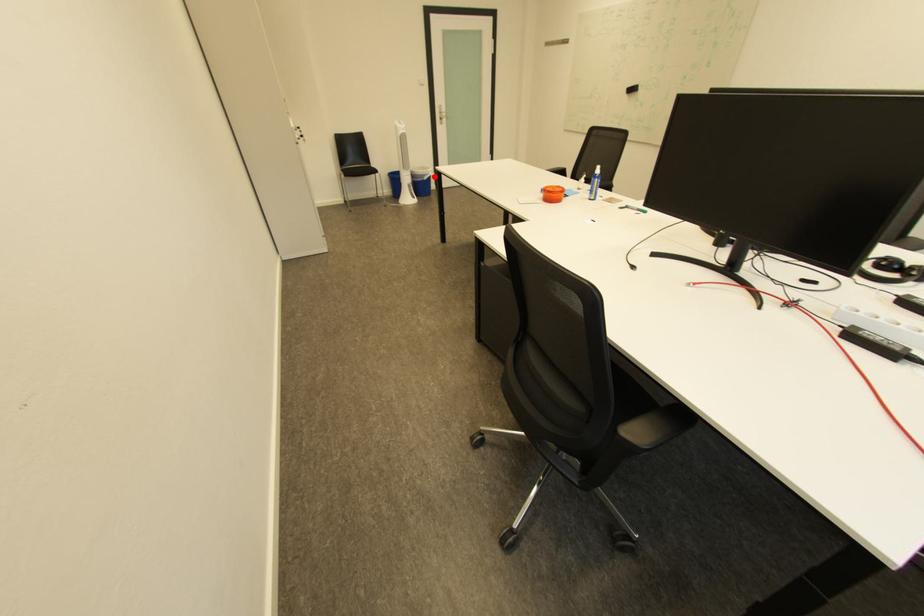
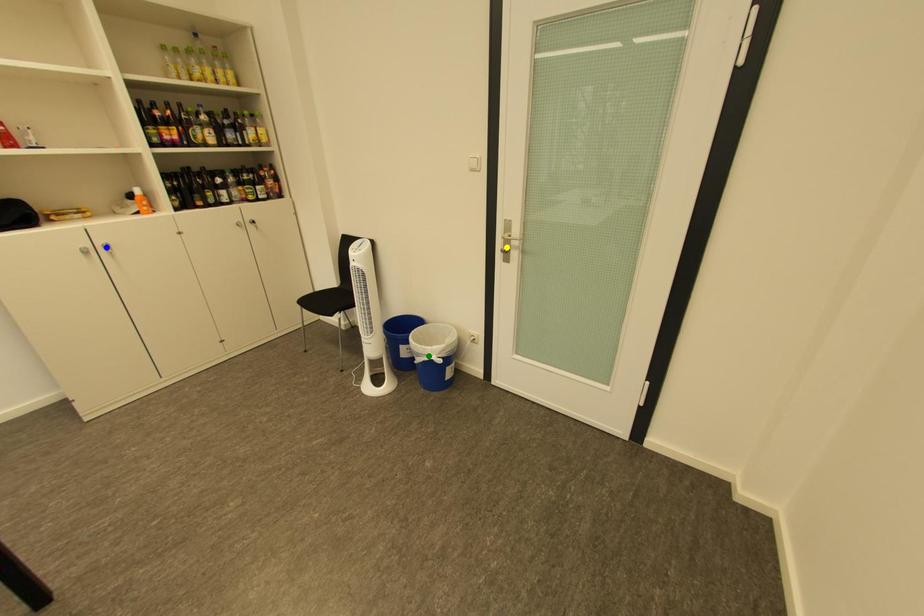
Question: I am providing you with two images of the same scene from different viewpoints. A red point is marked on the first image. You are given multiple points on the second image. Which spot in image 2 lines up with the point in image 1?

Choices:
 (A) green point
 (B) yellow point
 (C) blue point

Answer: (A)